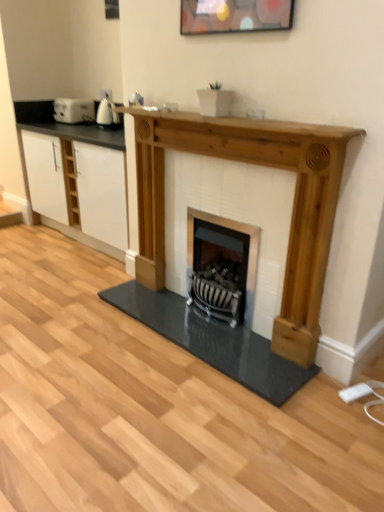
Question: Is white matte cabinet at center inside wooden shelf at center?

Choices:
 (A) no
 (B) yes

Answer: (A)

Question: Is wooden shelf at center to the left of white matte cabinet at center from the viewer's perspective?

Choices:
 (A) yes
 (B) no

Answer: (B)

Question: From a real-world perspective, is wooden shelf at center located beneath white matte cabinet at center?

Choices:
 (A) no
 (B) yes

Answer: (A)

Question: From a real-world perspective, is wooden shelf at center over white matte cabinet at center?

Choices:
 (A) yes
 (B) no

Answer: (A)

Question: Is wooden shelf at center not within white matte cabinet at center?

Choices:
 (A) yes
 (B) no

Answer: (A)

Question: Considering the relative sizes of wooden shelf at center and white matte cabinet at center in the image provided, is wooden shelf at center taller than white matte cabinet at center?

Choices:
 (A) yes
 (B) no

Answer: (B)

Question: From a real-world perspective, is white plastic toaster at left, the second appliance when ordered from front to back, over white glossy kettle at upper left, the 1th appliance positioned from the front?

Choices:
 (A) no
 (B) yes

Answer: (A)

Question: Does white plastic toaster at left, the second appliance when ordered from front to back, have a lesser width compared to white glossy kettle at upper left, positioned as the 2th appliance in left-to-right order?

Choices:
 (A) no
 (B) yes

Answer: (A)

Question: Is white glossy kettle at upper left, the second appliance when ordered from back to front, surrounded by white plastic toaster at left, acting as the first appliance starting from the back?

Choices:
 (A) no
 (B) yes

Answer: (A)

Question: Is white plastic toaster at left, acting as the first appliance starting from the back, further to the viewer compared to white glossy kettle at upper left, positioned as the 2th appliance in left-to-right order?

Choices:
 (A) no
 (B) yes

Answer: (B)

Question: Is white plastic toaster at left, the second appliance when ordered from front to back, located outside white glossy kettle at upper left, positioned as the 2th appliance in left-to-right order?

Choices:
 (A) yes
 (B) no

Answer: (A)

Question: From the image's perspective, is white plastic toaster at left, the second appliance when ordered from front to back, over white glossy kettle at upper left, the 1th appliance positioned from the front?

Choices:
 (A) yes
 (B) no

Answer: (A)

Question: From a real-world perspective, is wooden shelf at center located beneath black metal wood burning stove at center?

Choices:
 (A) yes
 (B) no

Answer: (B)